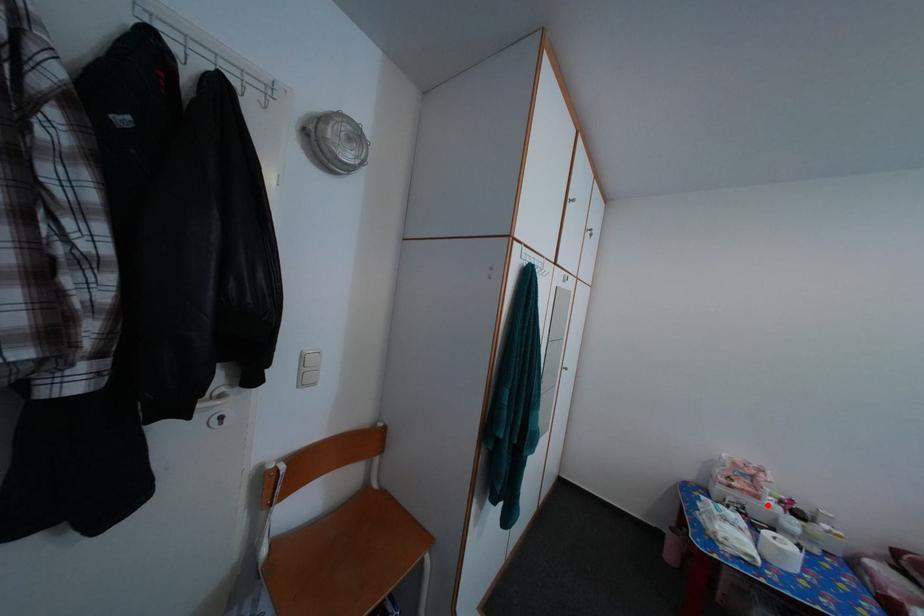
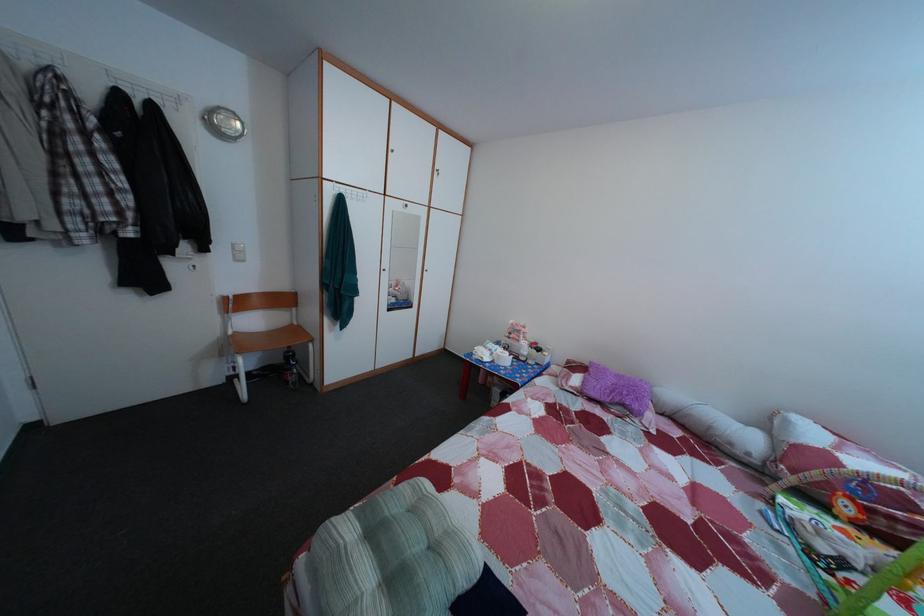
Locate, in the second image, the point that corresponds to the highlighted location in the first image.

(528, 349)